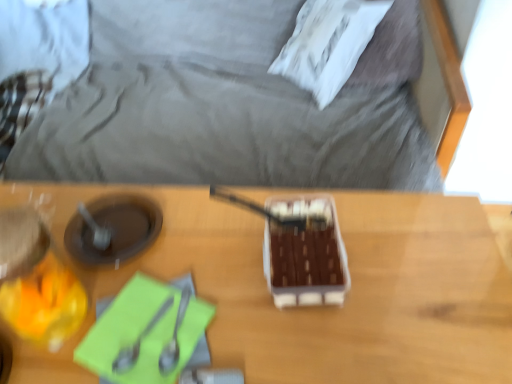
This screenshot has height=384, width=512. In order to click on vacant space to the left of satin silver spoon at lower left, placed as the 1th utensil when sorted from left to right in this screenshot , I will do `click(80, 340)`.